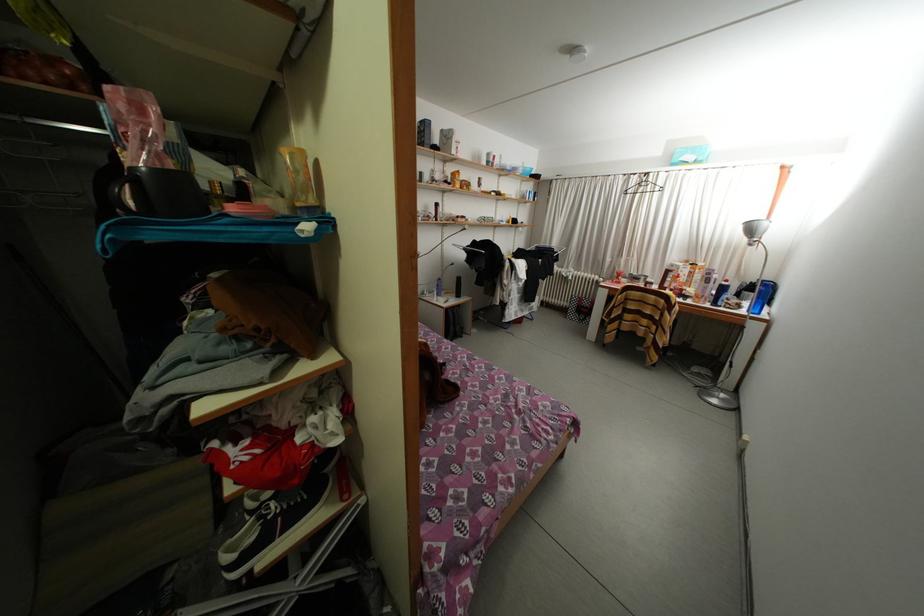
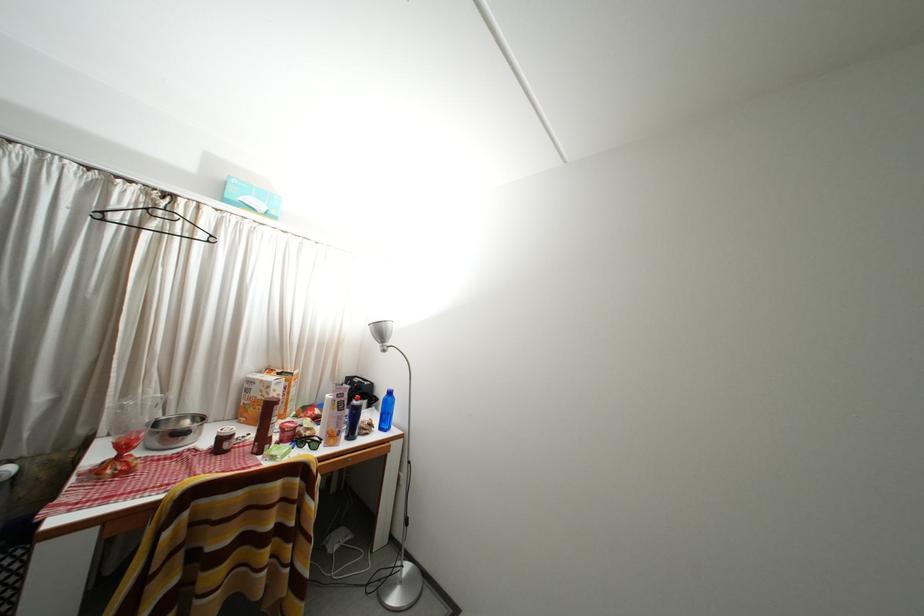
Find the pixel in the second image that matches pixel 649 196 in the first image.

(161, 230)